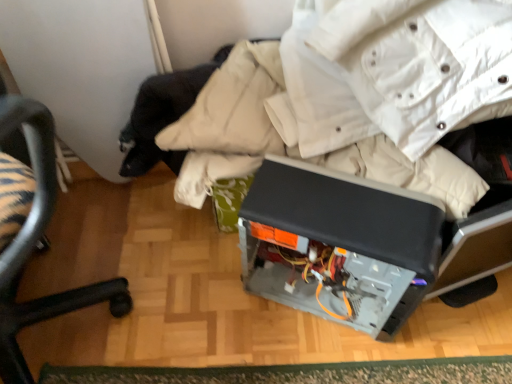
Where is `empty space that is ontop of satin black computer case at center (from a real-world perspective)`? This screenshot has width=512, height=384. empty space that is ontop of satin black computer case at center (from a real-world perspective) is located at coordinates (345, 205).